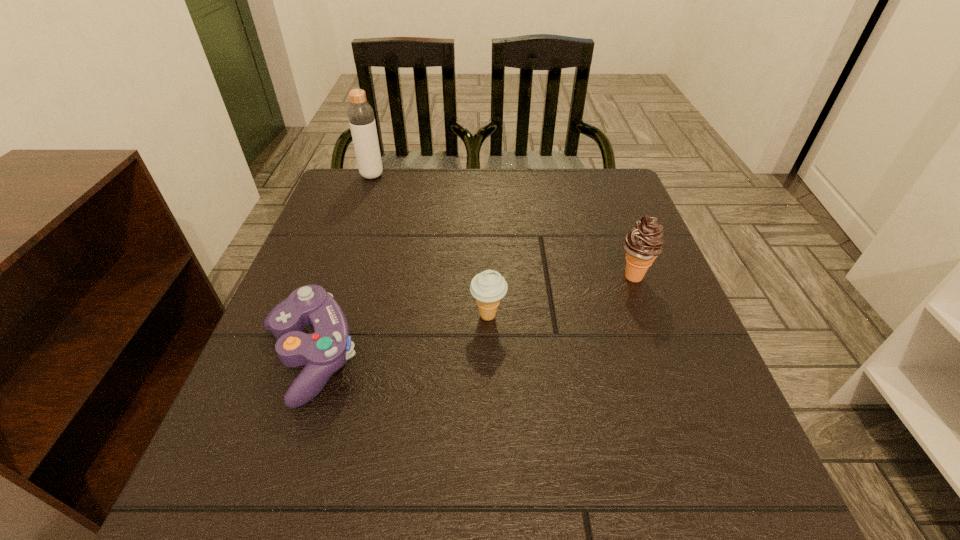
Find the location of `vacant space in between the control and the shorter icecream`. vacant space in between the control and the shorter icecream is located at coordinates (398, 336).

Select which object is the third closest to the shortest object. Please provide its 2D coordinates. Your answer should be formatted as a tuple, i.e. [(x, y)], where the tuple contains the x and y coordinates of a point satisfying the conditions above.

[(643, 243)]

Locate an element on the screen. The image size is (960, 540). object that can be found as the third closest to the taller icecream is located at coordinates (361, 117).

Find the location of a particular element. This screenshot has width=960, height=540. vacant region that satisfies the following two spatial constraints: 1. on the back side of the third object from left to right; 2. on the left side of the second tallest object is located at coordinates (488, 276).

The image size is (960, 540). In order to click on free space that satisfies the following two spatial constraints: 1. on the front side of the shortest object; 2. on the left side of the farthest object in this screenshot , I will do `click(309, 357)`.

At what (x,y) coordinates should I click in order to perform the action: click on vacant space that satisfies the following two spatial constraints: 1. on the back side of the rightmost object; 2. on the right side of the shortest object. Please return your answer as a coordinate pair (x, y). The width and height of the screenshot is (960, 540). Looking at the image, I should click on (337, 276).

Locate an element on the screen. vacant region that satisfies the following two spatial constraints: 1. on the front side of the tallest object; 2. on the left side of the shortest object is located at coordinates (309, 357).